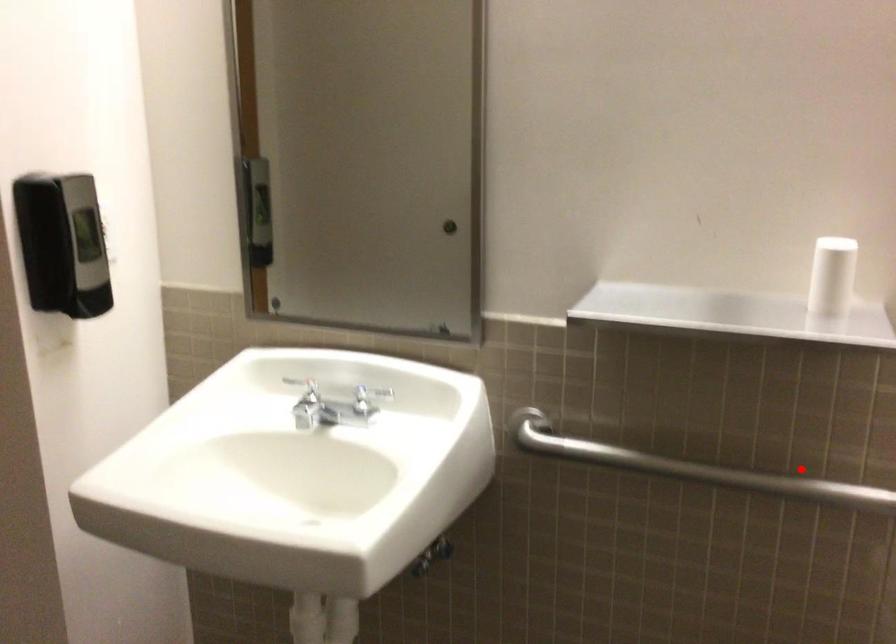
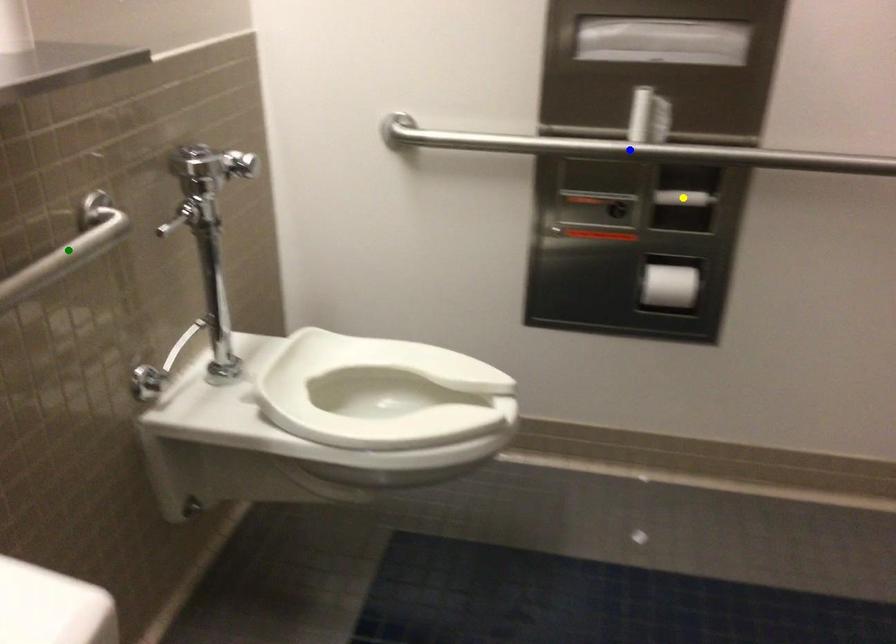
Question: I am providing you with two images of the same scene from different viewpoints. A red point is marked on the first image. You are given multiple points on the second image. In image 2, which mark is for the same physical point as the one in image 1?

Choices:
 (A) yellow point
 (B) green point
 (C) blue point

Answer: (B)